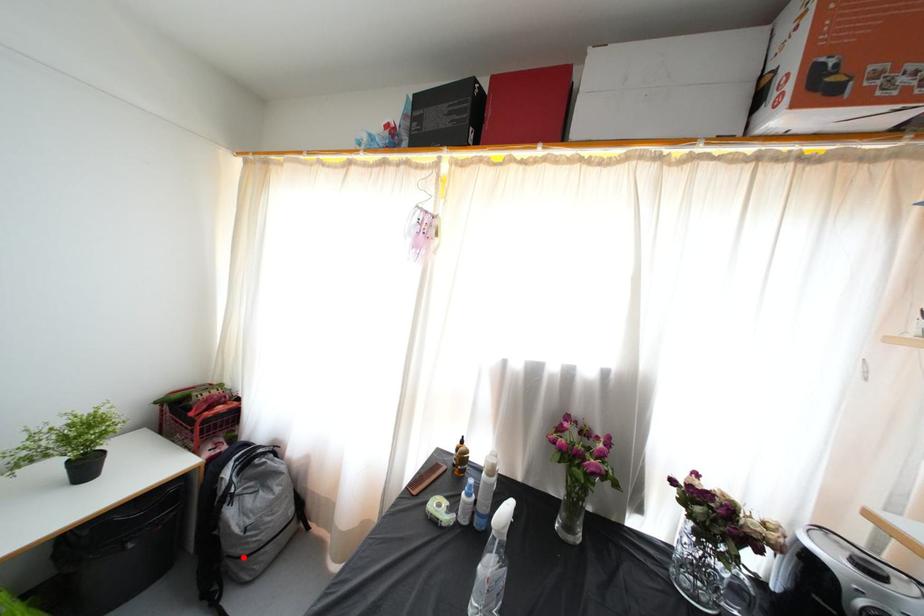
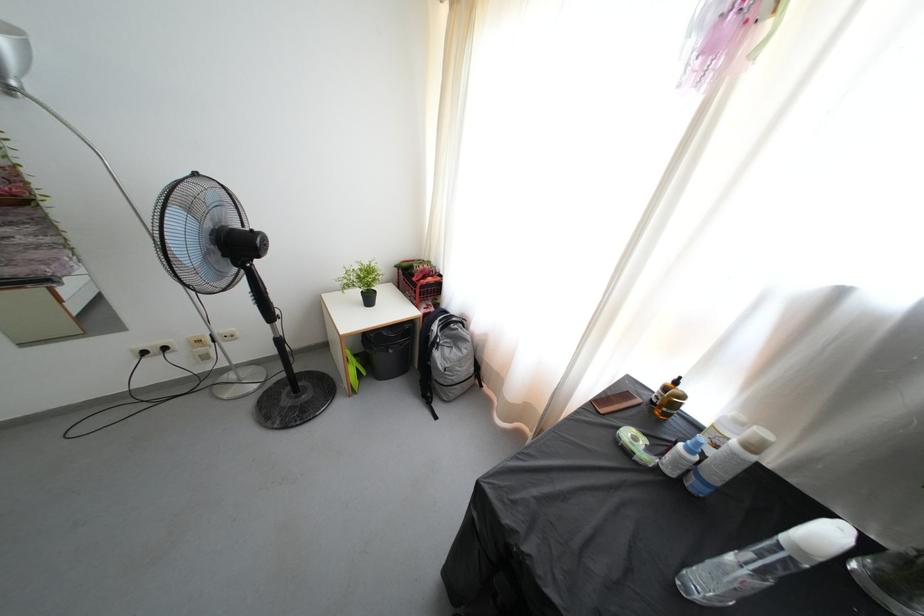
Find the pixel in the second image that matches the highlighted location in the first image.

(445, 387)